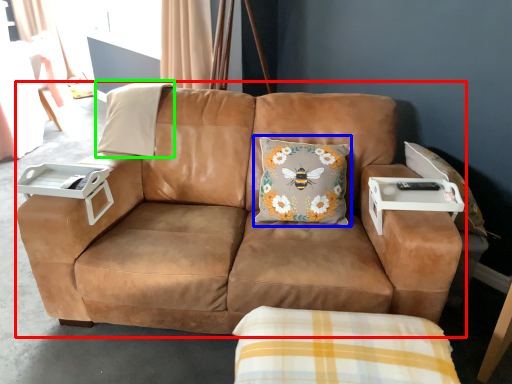
Question: Considering the real-world distances, which object is closest to studio couch (highlighted by a red box)? throw pillow (highlighted by a blue box) or pillow (highlighted by a green box).

Choices:
 (A) throw pillow
 (B) pillow

Answer: (A)